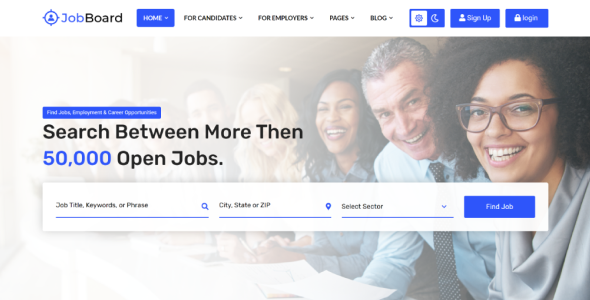
At what (x,y) coordinates should I click in order to perform the action: click on box. Please return your answer as a coordinate pair (x, y). The height and width of the screenshot is (300, 590). Looking at the image, I should click on (110, 116).